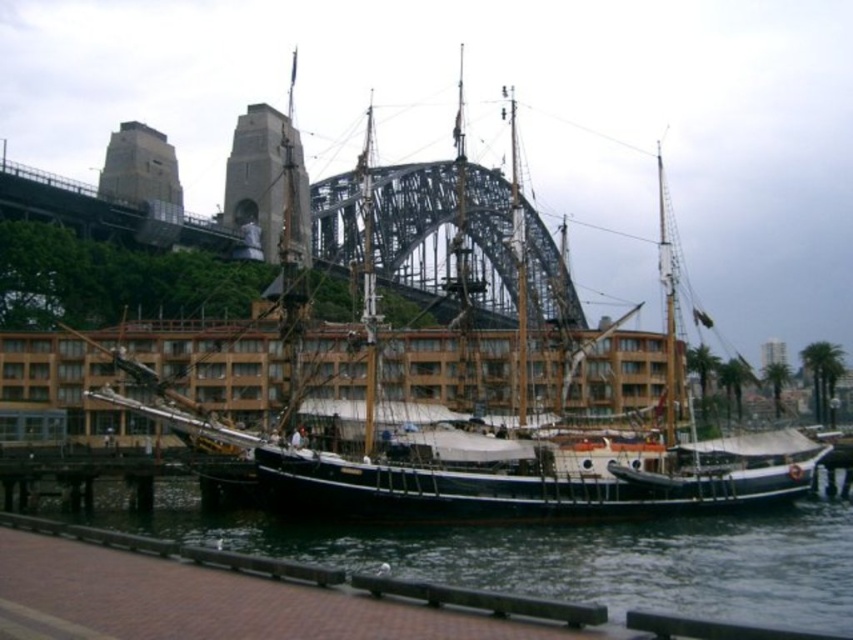
Question: Which is farther from the wooden ship at center?

Choices:
 (A) black water at lower center
 (B) metallic steel bridge at upper center

Answer: (A)

Question: Does metallic steel bridge at upper center have a lesser width compared to black water at lower center?

Choices:
 (A) yes
 (B) no

Answer: (B)

Question: Which object is closer to the camera taking this photo?

Choices:
 (A) metallic steel bridge at upper center
 (B) black water at lower center

Answer: (B)

Question: Which point is closer to the camera?

Choices:
 (A) black water at lower center
 (B) metallic steel bridge at upper center

Answer: (A)

Question: In this image, where is metallic steel bridge at upper center located relative to black water at lower center?

Choices:
 (A) right
 (B) left

Answer: (A)

Question: Can you confirm if wooden ship at center is smaller than black water at lower center?

Choices:
 (A) no
 (B) yes

Answer: (A)